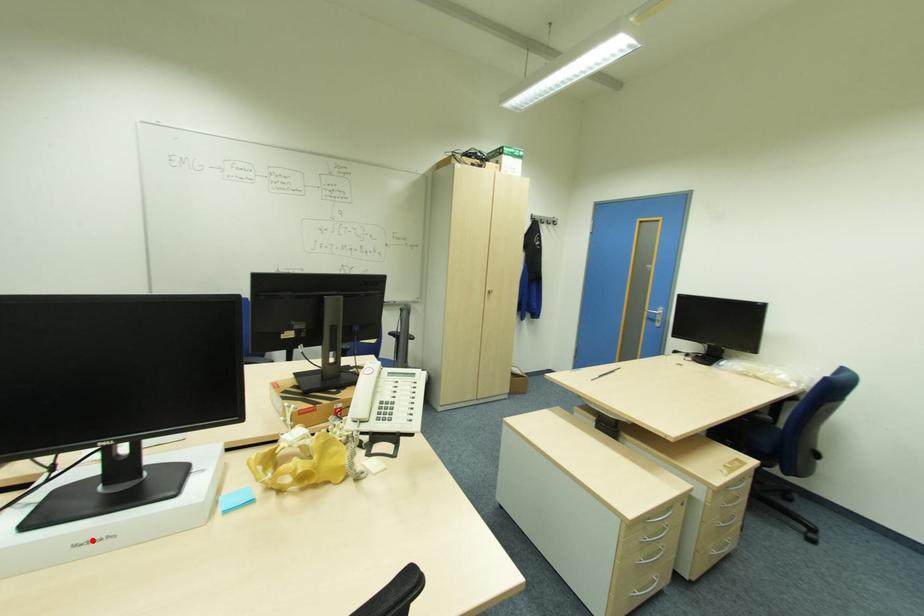
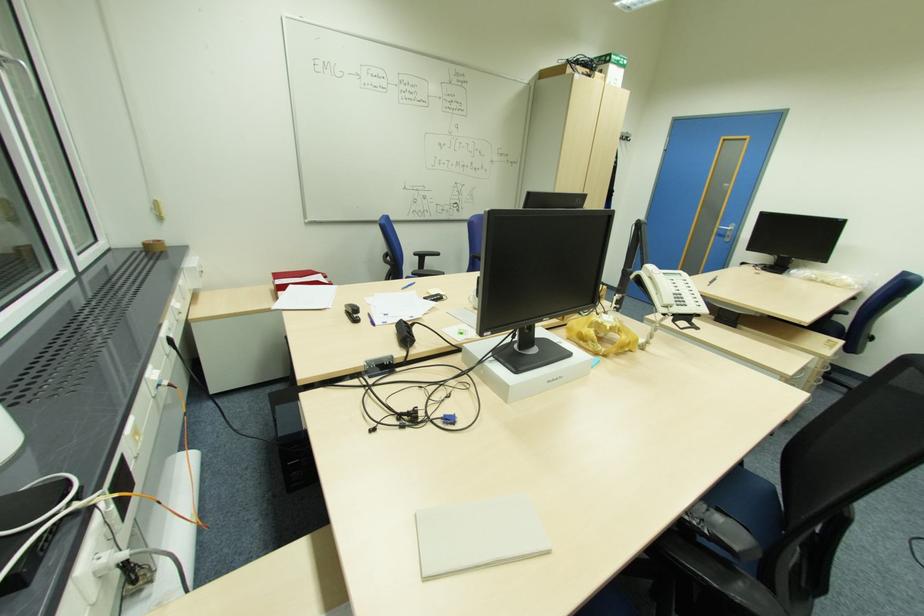
Question: I am providing you with two images of the same scene from different viewpoints. Image1 has a red point marked. In image2, the corresponding 3D location appears at what relative position? Reply with the corresponding letter.

Choices:
 (A) Closer
 (B) Farther

Answer: (A)